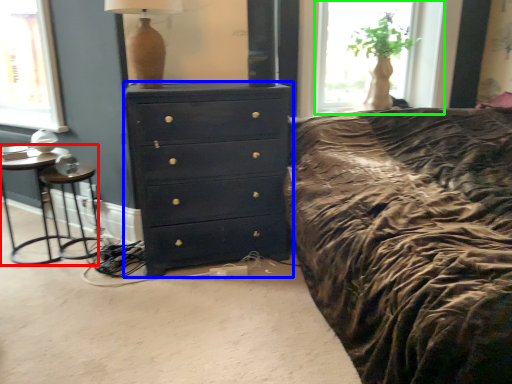
Question: Which is farther away from nightstand (highlighted by a red box)? chest of drawers (highlighted by a blue box) or window (highlighted by a green box)?

Choices:
 (A) chest of drawers
 (B) window

Answer: (B)